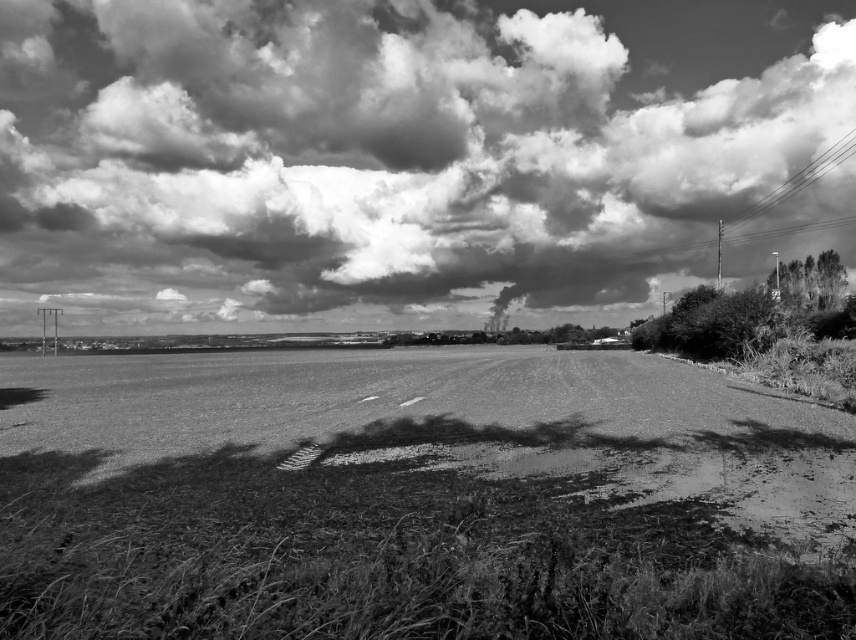
Looking at this image, based on the scene described, what is located at the coordinates point [446,426]?

The point at [446,426] corresponds to dirt or gritty material at the center of the image.